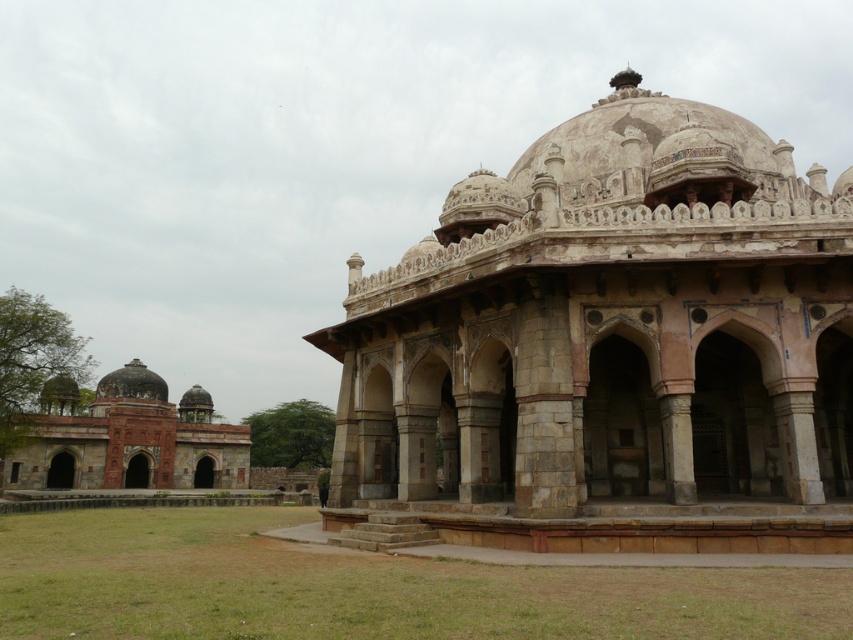
Based on the photo, which is more to the right, stone dome at center or reddish-brown stone domes at left?

stone dome at center

Does stone dome at center have a smaller size compared to reddish-brown stone domes at left?

Actually, stone dome at center might be larger than reddish-brown stone domes at left.

Image resolution: width=853 pixels, height=640 pixels. What do you see at coordinates (611, 346) in the screenshot?
I see `stone dome at center` at bounding box center [611, 346].

Where is `stone dome at center`? stone dome at center is located at coordinates (611, 346).